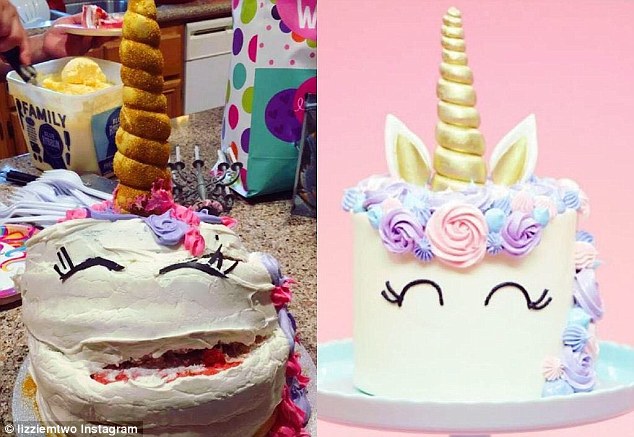
Where is `table`? This screenshot has height=437, width=634. table is located at coordinates (264, 230).